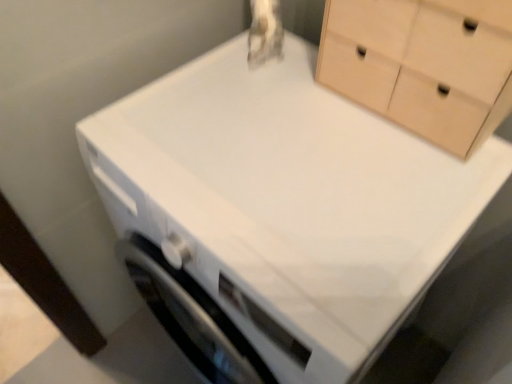
Locate an element on the screen. The height and width of the screenshot is (384, 512). matte cardboard chest of drawers at upper right is located at coordinates (423, 64).

Image resolution: width=512 pixels, height=384 pixels. What do you see at coordinates (423, 64) in the screenshot? I see `matte cardboard chest of drawers at upper right` at bounding box center [423, 64].

Find the location of a particular element. This screenshot has width=512, height=384. matte cardboard chest of drawers at upper right is located at coordinates (423, 64).